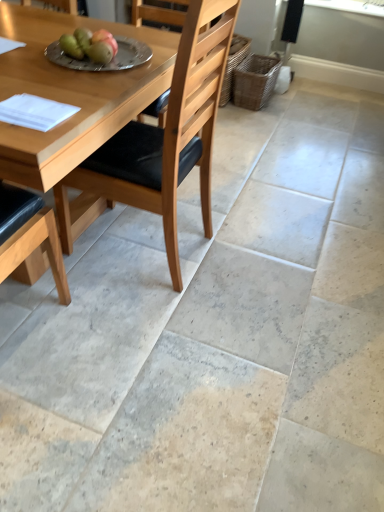
Identify the location of light brown wood chair at center. (165, 136).

Locate an element on the screen. Image resolution: width=384 pixels, height=512 pixels. white paper at lower left is located at coordinates (35, 112).

Which object is further away from the camera, green matte pears at upper center, the second fruit from the left, or woven brown basket at right?

woven brown basket at right is further from the camera.

From the image's perspective, relative to woven brown basket at right, is green matte pears at upper center, the second fruit from the left, above or below?

Clearly, from the image's perspective, green matte pears at upper center, the second fruit from the left, is below woven brown basket at right.

Considering the points (100, 49) and (266, 102), which point is behind, point (100, 49) or point (266, 102)?

The point (266, 102) is farther.

Looking at their sizes, would you say green matte pears at upper center, the first fruit in the right-to-left sequence, is wider or thinner than woven brown basket at right?

green matte pears at upper center, the first fruit in the right-to-left sequence, is thinner than woven brown basket at right.

Consider the image. Are light brown wood chair at center and white paper at lower left far apart?

light brown wood chair at center is near white paper at lower left, not far away.

Can you confirm if light brown wood chair at center is positioned to the left of white paper at lower left?

No.

Can we say light brown wood chair at center lies outside white paper at lower left?

That's correct, light brown wood chair at center is outside of white paper at lower left.

Is light brown wood chair at center in front of or behind white paper at lower left in the image?

light brown wood chair at center is in front of white paper at lower left.

Does green matte pears at upper center, the second fruit from the left, have a greater height compared to light brown wood chair at center?

Incorrect, the height of green matte pears at upper center, the second fruit from the left, is not larger of that of light brown wood chair at center.

Which is more to the left, green matte pears at upper center, the first fruit in the right-to-left sequence, or light brown wood chair at center?

From the viewer's perspective, green matte pears at upper center, the first fruit in the right-to-left sequence, appears more on the left side.

In the scene shown: Considering the relative sizes of green matte pears at upper center, the first fruit in the right-to-left sequence, and light brown wood chair at center in the image provided, is green matte pears at upper center, the first fruit in the right-to-left sequence, bigger than light brown wood chair at center?

No, green matte pears at upper center, the first fruit in the right-to-left sequence, is not bigger than light brown wood chair at center.

Which object is closer to the camera, green matte pears at upper center, the first fruit in the right-to-left sequence, or light brown wood chair at center?

light brown wood chair at center is in front.

Who is smaller, silver metallic plate at upper center or white paper at lower left?

Smaller between the two is white paper at lower left.

In the scene shown: From the image's perspective, between silver metallic plate at upper center and white paper at lower left, who is located below?

From the image's view, white paper at lower left is below.

Can you tell me how much silver metallic plate at upper center and white paper at lower left differ in facing direction?

0.00019 degrees separate the facing orientations of silver metallic plate at upper center and white paper at lower left.

Is point (54, 62) more distant than point (78, 108)?

Yes.

Which object is positioned more to the right, silver metallic plate at upper center or green matte pears at upper center, the first fruit in the right-to-left sequence?

Positioned to the right is green matte pears at upper center, the first fruit in the right-to-left sequence.

The height and width of the screenshot is (512, 384). I want to click on fruit in front of the silver metallic plate at upper center, so click(x=101, y=51).

Considering the sizes of objects silver metallic plate at upper center and green matte pears at upper center, the second fruit from the left, in the image provided, who is thinner, silver metallic plate at upper center or green matte pears at upper center, the second fruit from the left,?

green matte pears at upper center, the second fruit from the left, is thinner.

Based on their sizes in the image, would you say silver metallic plate at upper center is bigger or smaller than green matte pears at upper center, the first fruit in the right-to-left sequence?

silver metallic plate at upper center is bigger than green matte pears at upper center, the first fruit in the right-to-left sequence.

Could you tell me if green matte apple at upper left, acting as the 2th fruit starting from the right, is facing green matte pears at upper center, the second fruit from the left?

No, green matte apple at upper left, acting as the 2th fruit starting from the right, is not oriented towards green matte pears at upper center, the second fruit from the left.

Find the location of a particular element. The width and height of the screenshot is (384, 512). fruit that appears in front of the green matte apple at upper left, acting as the 2th fruit starting from the right is located at coordinates (101, 51).

In the scene shown: Between green matte apple at upper left, the 1th fruit from the left, and green matte pears at upper center, the first fruit in the right-to-left sequence, which one has less height?

green matte pears at upper center, the first fruit in the right-to-left sequence.

Which of these two, green matte apple at upper left, the 1th fruit from the left, or green matte pears at upper center, the second fruit from the left, is thinner?

With smaller width is green matte pears at upper center, the second fruit from the left.

Considering the sizes of objects woven brown basket at right and light brown wood chair at center in the image provided, who is shorter, woven brown basket at right or light brown wood chair at center?

woven brown basket at right is shorter.

From the image's perspective, is woven brown basket at right positioned above or below light brown wood chair at center?

woven brown basket at right is situated higher than light brown wood chair at center in the image.

Looking at this image, from a real-world perspective, who is located lower, woven brown basket at right or light brown wood chair at center?

woven brown basket at right.

Is woven brown basket at right thinner than light brown wood chair at center?

Yes, woven brown basket at right is thinner than light brown wood chair at center.

Where is `fruit that is the 2nd one when counting downward from the woven brown basket at right (from the image's perspective)`? fruit that is the 2nd one when counting downward from the woven brown basket at right (from the image's perspective) is located at coordinates (101, 51).

You are a GUI agent. You are given a task and a screenshot of the screen. Output one action in this format:
    pyautogui.click(x=<x>, y=<y>)
    Task: Click on the pad behind the light brown wood chair at center
    
    Given the screenshot: What is the action you would take?
    pyautogui.click(x=35, y=112)

Which object lies nearer to the anchor point white paper at lower left, woven brown basket at right or silver metallic plate at upper center?

Among the two, silver metallic plate at upper center is located nearer to white paper at lower left.

From the image, which object appears to be farther from green matte pears at upper center, the second fruit from the left, white paper at lower left or green matte apple at upper left, acting as the 2th fruit starting from the right?

white paper at lower left.

Which object lies nearer to the anchor point green matte pears at upper center, the first fruit in the right-to-left sequence, green matte apple at upper left, acting as the 2th fruit starting from the right, or silver metallic plate at upper center?

green matte apple at upper left, acting as the 2th fruit starting from the right.

Based on the photo, from the image, which object appears to be farther from green matte pears at upper center, the second fruit from the left, green matte apple at upper left, acting as the 2th fruit starting from the right, or light brown wood chair at center?

The object further to green matte pears at upper center, the second fruit from the left, is light brown wood chair at center.

Considering their positions, is white paper at lower left positioned further to green matte apple at upper left, acting as the 2th fruit starting from the right, than woven brown basket at right?

The object further to green matte apple at upper left, acting as the 2th fruit starting from the right, is woven brown basket at right.

Considering their positions, is white paper at lower left positioned further to light brown wood chair at center than woven brown basket at right?

woven brown basket at right is positioned further to the anchor light brown wood chair at center.

When comparing their distances from silver metallic plate at upper center, does green matte apple at upper left, the 1th fruit from the left, or light brown wood chair at center seem closer?

green matte apple at upper left, the 1th fruit from the left, is positioned closer to the anchor silver metallic plate at upper center.

Which object lies further to the anchor point green matte pears at upper center, the second fruit from the left, light brown wood chair at center or silver metallic plate at upper center?

light brown wood chair at center.

Find the location of `fruit between green matte apple at upper left, the 1th fruit from the left, and white paper at lower left, in the vertical direction`. fruit between green matte apple at upper left, the 1th fruit from the left, and white paper at lower left, in the vertical direction is located at coordinates (101, 51).

Where is `fruit between light brown wood chair at center and silver metallic plate at upper center from front to back`? fruit between light brown wood chair at center and silver metallic plate at upper center from front to back is located at coordinates (101, 51).

Where is `pad positioned between light brown wood chair at center and green matte pears at upper center, the second fruit from the left, from near to far`? The height and width of the screenshot is (512, 384). pad positioned between light brown wood chair at center and green matte pears at upper center, the second fruit from the left, from near to far is located at coordinates 35,112.

Identify the location of plate positioned between light brown wood chair at center and green matte apple at upper left, the 1th fruit from the left, from near to far. (100, 64).